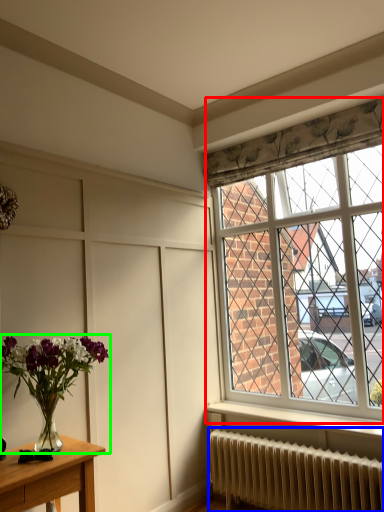
Question: Which object is positioned farthest from window (highlighted by a red box)? Select from radiator (highlighted by a blue box) and houseplant (highlighted by a green box).

Choices:
 (A) radiator
 (B) houseplant

Answer: (B)